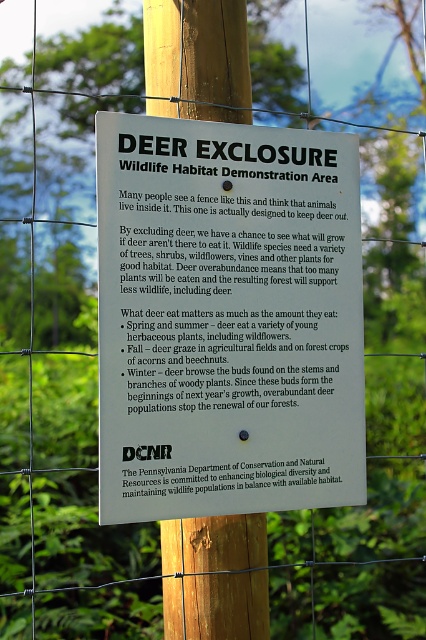
Question: Is white paper sign at center bigger than wooden post at center?

Choices:
 (A) yes
 (B) no

Answer: (A)

Question: Which point is farther from the camera taking this photo?

Choices:
 (A) (152, 4)
 (B) (356, 429)

Answer: (A)

Question: Can you confirm if white paper sign at center is positioned below wooden post at center?

Choices:
 (A) no
 (B) yes

Answer: (A)

Question: Which point is farther to the camera?

Choices:
 (A) white paper sign at center
 (B) wooden post at center

Answer: (B)

Question: Is white paper sign at center thinner than wooden post at center?

Choices:
 (A) no
 (B) yes

Answer: (A)